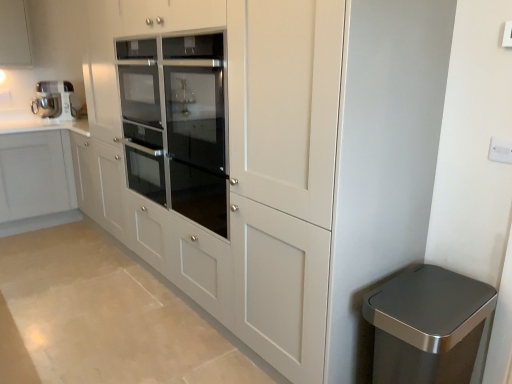
Describe the element at coordinates (426, 325) in the screenshot. I see `satin silver trash can at lower right` at that location.

In the scene shown: What is the approximate width of matte white cabinet at upper left?

It is 15.22 inches.

What is the approximate width of metallic silver mixer at upper left?

The width of metallic silver mixer at upper left is 20.77 centimeters.

This screenshot has height=384, width=512. I want to click on satin silver trash can at lower right, so click(426, 325).

Based on the photo, which of these two, white plastic electric outlet at upper right or matte white cabinet at upper left, stands shorter?

With less height is white plastic electric outlet at upper right.

From a real-world perspective, is white plastic electric outlet at upper right physically below matte white cabinet at upper left?

Correct, in the physical world, white plastic electric outlet at upper right is lower than matte white cabinet at upper left.

Relative to matte white cabinet at upper left, is white plastic electric outlet at upper right in front or behind?

In the image, white plastic electric outlet at upper right appears in front of matte white cabinet at upper left.

Is the surface of white plastic electric outlet at upper right in direct contact with matte white cabinet at upper left?

white plastic electric outlet at upper right and matte white cabinet at upper left are clearly separated.

Considering the sizes of objects metallic silver mixer at upper left and satin silver trash can at lower right in the image provided, who is smaller, metallic silver mixer at upper left or satin silver trash can at lower right?

metallic silver mixer at upper left is smaller.

In terms of width, does metallic silver mixer at upper left look wider or thinner when compared to satin silver trash can at lower right?

Clearly, metallic silver mixer at upper left has less width compared to satin silver trash can at lower right.

Can you confirm if metallic silver mixer at upper left is shorter than satin silver trash can at lower right?

Correct, metallic silver mixer at upper left is not as tall as satin silver trash can at lower right.

Does point (36, 101) come behind point (487, 296)?

Yes, it is.

Who is shorter, white plastic electric outlet at upper right or metallic silver mixer at upper left?

Standing shorter between the two is white plastic electric outlet at upper right.

Is white plastic electric outlet at upper right positioned beyond the bounds of metallic silver mixer at upper left?

Indeed, white plastic electric outlet at upper right is completely outside metallic silver mixer at upper left.

Is white plastic electric outlet at upper right oriented towards metallic silver mixer at upper left?

No.

Is matte white cabinet at upper left positioned before metallic silver mixer at upper left?

Yes, matte white cabinet at upper left is closer to the camera.

Would you say matte white cabinet at upper left is a long distance from metallic silver mixer at upper left?

That's not correct — matte white cabinet at upper left is a little close to metallic silver mixer at upper left.

Would you say matte white cabinet at upper left is outside metallic silver mixer at upper left?

Indeed, matte white cabinet at upper left is completely outside metallic silver mixer at upper left.

Where is `cabinetry on the left of metallic silver mixer at upper left`? The width and height of the screenshot is (512, 384). cabinetry on the left of metallic silver mixer at upper left is located at coordinates (15, 34).

From a real-world perspective, relative to matte white cabinet at upper left, is metallic silver mixer at upper left vertically above or below?

From a real-world perspective, metallic silver mixer at upper left is physically below matte white cabinet at upper left.

Between point (1, 55) and point (476, 284), which one is positioned in front?

The point (476, 284) is in front.

From a real-world perspective, is matte white cabinet at upper left above or below satin silver trash can at lower right?

matte white cabinet at upper left is situated higher than satin silver trash can at lower right in the real world.

There is a satin silver trash can at lower right. In order to click on cabinetry above it (from a real-world perspective) in this screenshot , I will do pyautogui.click(x=15, y=34).

Considering the sizes of objects matte white cabinet at upper left and satin silver trash can at lower right in the image provided, who is wider, matte white cabinet at upper left or satin silver trash can at lower right?

matte white cabinet at upper left is wider.

Looking at this image, is the surface of satin silver trash can at lower right in direct contact with matte white cabinet at upper left?

No.

From a real-world perspective, is satin silver trash can at lower right located higher than matte white cabinet at upper left?

Incorrect, from a real-world perspective, satin silver trash can at lower right is lower than matte white cabinet at upper left.

Which object is wider, satin silver trash can at lower right or matte white cabinet at upper left?

matte white cabinet at upper left.

At what (x,y) coordinates should I click in order to perform the action: click on cabinetry above the white plastic electric outlet at upper right (from the image's perspective). Please return your answer as a coordinate pair (x, y). Image resolution: width=512 pixels, height=384 pixels. Looking at the image, I should click on (15, 34).

This screenshot has width=512, height=384. Identify the location of home appliance behind the satin silver trash can at lower right. (54, 100).

Based on their spatial positions, is satin silver trash can at lower right or metallic silver mixer at upper left closer to matte white cabinet at upper left?

The object closer to matte white cabinet at upper left is metallic silver mixer at upper left.

Estimate the real-world distances between objects in this image. Which object is further from satin silver trash can at lower right, matte white cabinet at upper left or metallic silver mixer at upper left?

Among the two, matte white cabinet at upper left is located further to satin silver trash can at lower right.

Looking at the image, which one is located closer to metallic silver mixer at upper left, satin silver trash can at lower right or white plastic electric outlet at upper right?

Based on the image, satin silver trash can at lower right appears to be nearer to metallic silver mixer at upper left.

Based on the photo, estimate the real-world distances between objects in this image. Which object is further from matte white cabinet at upper left, white plastic electric outlet at upper right or metallic silver mixer at upper left?

white plastic electric outlet at upper right.

Considering their positions, is satin silver trash can at lower right positioned closer to matte white cabinet at upper left than white plastic electric outlet at upper right?

Among the two, satin silver trash can at lower right is located nearer to matte white cabinet at upper left.

When comparing their distances from satin silver trash can at lower right, does white plastic electric outlet at upper right or metallic silver mixer at upper left seem closer?

Among the two, white plastic electric outlet at upper right is located nearer to satin silver trash can at lower right.

When comparing their distances from white plastic electric outlet at upper right, does matte white cabinet at upper left or metallic silver mixer at upper left seem further?

Based on the image, matte white cabinet at upper left appears to be further to white plastic electric outlet at upper right.

Looking at the image, which one is located closer to metallic silver mixer at upper left, satin silver trash can at lower right or matte white cabinet at upper left?

Among the two, matte white cabinet at upper left is located nearer to metallic silver mixer at upper left.

Where is `waste container between matte white cabinet at upper left and white plastic electric outlet at upper right in the horizontal direction`? This screenshot has height=384, width=512. waste container between matte white cabinet at upper left and white plastic electric outlet at upper right in the horizontal direction is located at coordinates (426, 325).

Find the location of a particular element. The width and height of the screenshot is (512, 384). home appliance between matte white cabinet at upper left and white plastic electric outlet at upper right is located at coordinates (54, 100).

Image resolution: width=512 pixels, height=384 pixels. Find the location of `home appliance situated between matte white cabinet at upper left and satin silver trash can at lower right from left to right`. home appliance situated between matte white cabinet at upper left and satin silver trash can at lower right from left to right is located at coordinates (54, 100).

The image size is (512, 384). I want to click on waste container situated between metallic silver mixer at upper left and white plastic electric outlet at upper right from left to right, so click(x=426, y=325).